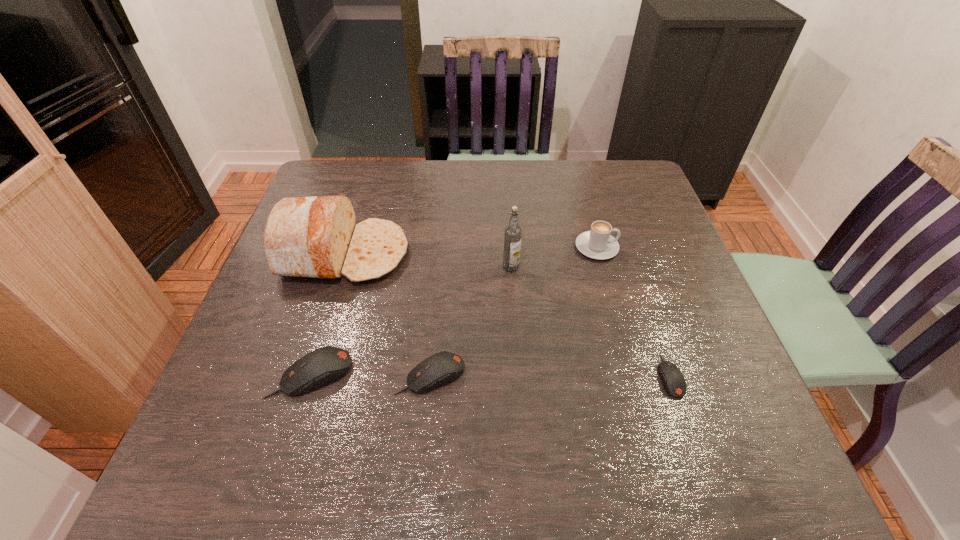
Where is `object at the near right corner`? The image size is (960, 540). object at the near right corner is located at coordinates (673, 382).

The image size is (960, 540). In order to click on vacant space at the far edge of the desktop in this screenshot , I will do `click(401, 205)`.

I want to click on vacant space at the near edge, so click(629, 400).

Where is `vacant point at the left edge`? vacant point at the left edge is located at coordinates (236, 362).

This screenshot has width=960, height=540. I want to click on free spot at the far left corner of the desktop, so point(322,176).

Locate an element on the screen. This screenshot has height=540, width=960. free space at the far right corner of the desktop is located at coordinates (611, 193).

This screenshot has width=960, height=540. Identify the location of free space between the leftmost computer mouse and the bread. (328, 314).

Where is `vacant area that lies between the bread and the shortest object`? vacant area that lies between the bread and the shortest object is located at coordinates (507, 315).

The height and width of the screenshot is (540, 960). In order to click on free point between the third tallest object and the bread in this screenshot , I will do `click(470, 251)`.

Where is `vacant space that is in between the shortest object and the fifth shortest object`? vacant space that is in between the shortest object and the fifth shortest object is located at coordinates (507, 315).